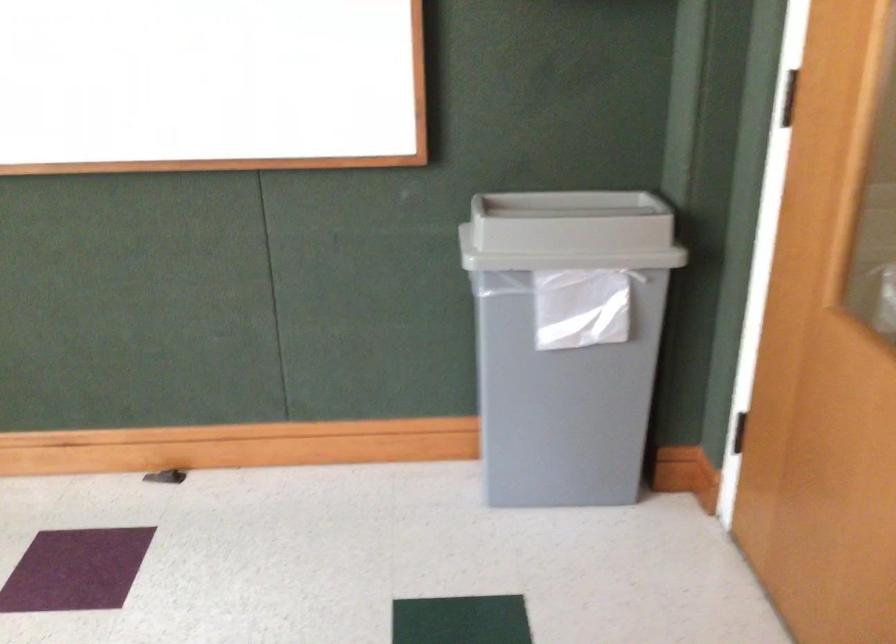
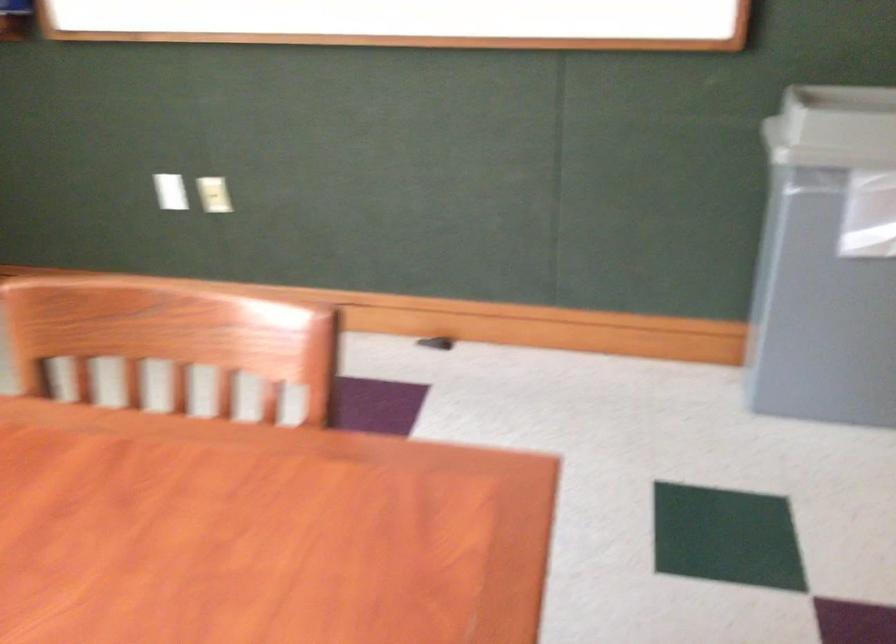
Question: The camera is either moving clockwise (left) or counter-clockwise (right) around the object. The first image is from the beginning of the video and the second image is from the end. Is the camera moving left or right when shooting the video?

Choices:
 (A) Left
 (B) Right

Answer: (B)